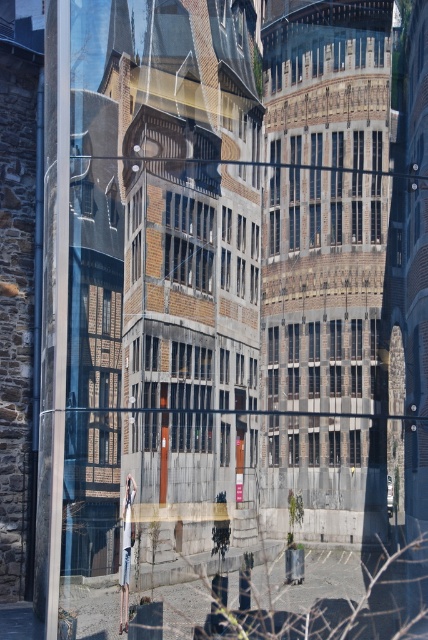
From the picture: Does dark gray stone window at center appear over metallic statue at center?

Yes.

Is dark gray stone window at center shorter than metallic statue at center?

Yes, dark gray stone window at center is shorter than metallic statue at center.

Does point (353, 371) come farther from viewer compared to point (133, 477)?

Yes, point (353, 371) is behind point (133, 477).

Find the location of a particular element. This screenshot has height=640, width=428. dark gray stone window at center is located at coordinates pyautogui.click(x=320, y=387).

Who is positioned more to the left, brown brick window at center or metallic statue at center?

metallic statue at center is more to the left.

In the scene shown: Who is shorter, brown brick window at center or metallic statue at center?

Standing shorter between the two is brown brick window at center.

This screenshot has width=428, height=640. In order to click on brown brick window at center in this screenshot , I will do `click(189, 241)`.

Locate an element on the screen. This screenshot has width=428, height=640. brown brick window at center is located at coordinates (189, 241).

Based on the photo, measure the distance between dark gray stone window at center and camera.

A distance of 6.72 meters exists between dark gray stone window at center and camera.

Which is in front, point (353, 385) or point (189, 208)?

Point (189, 208) is in front.

Is point (317, 413) closer to camera compared to point (189, 248)?

Yes.

I want to click on dark gray stone window at center, so click(320, 387).